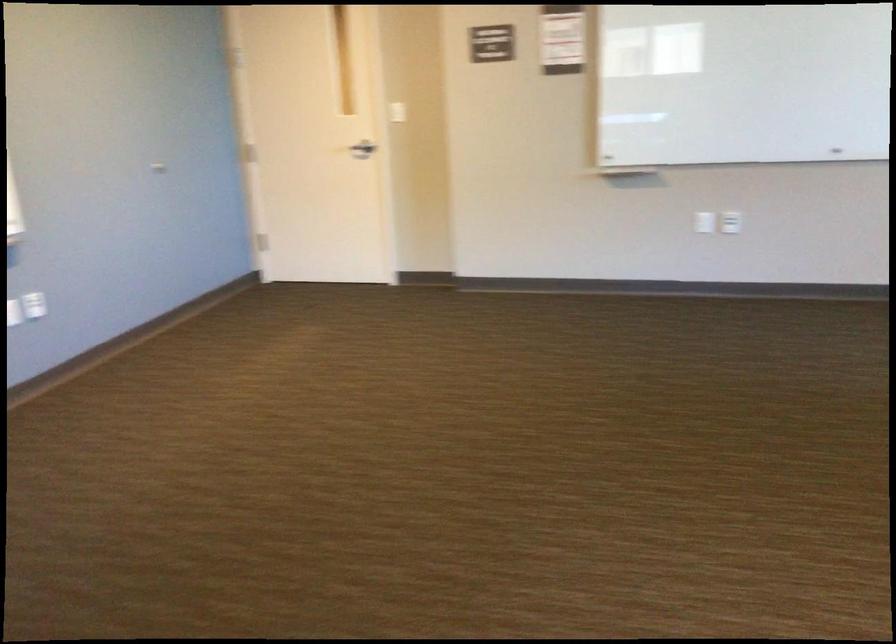
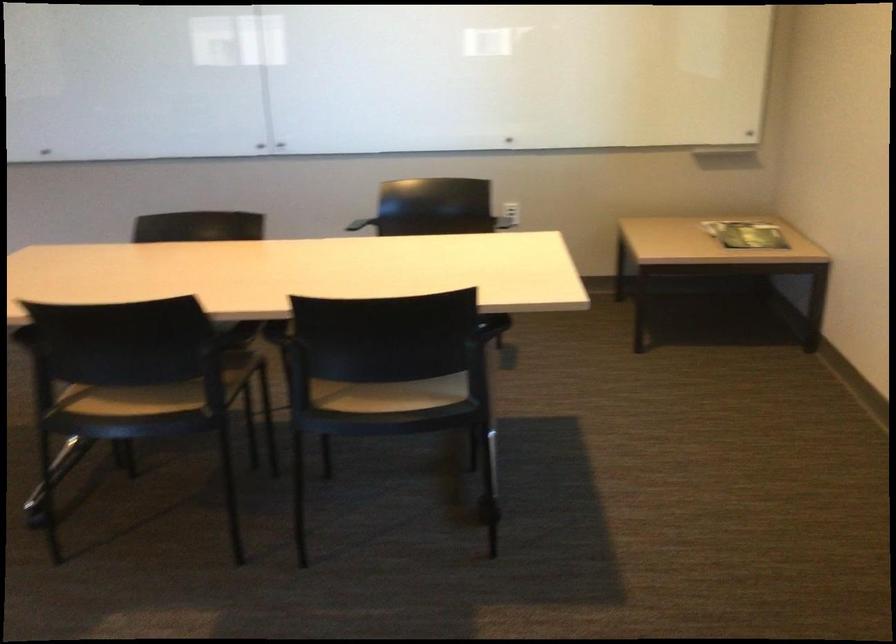
Question: What movement of the cameraman would produce the second image?

Choices:
 (A) Left
 (B) Right
 (C) Forward
 (D) Backward

Answer: (D)